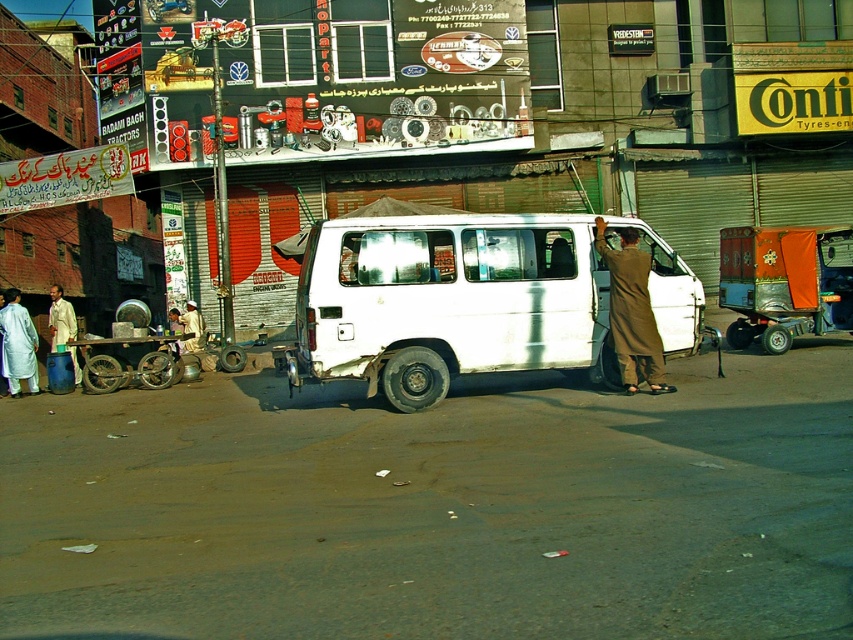
Question: Which of the following is the closest to the observer?

Choices:
 (A) (22, 349)
 (B) (387, 312)
 (C) (633, 312)

Answer: (B)

Question: From the image, what is the correct spatial relationship of metallic silver cart at lower left in relation to white cotton shirt at left?

Choices:
 (A) right
 (B) left

Answer: (A)

Question: Can you confirm if orange fabric cart at right is bigger than brown fabric at right?

Choices:
 (A) yes
 (B) no

Answer: (A)

Question: Does brown fabric at right have a larger size compared to metallic silver cart at lower left?

Choices:
 (A) yes
 (B) no

Answer: (B)

Question: Which of the following is the farthest from the observer?

Choices:
 (A) white cotton shirt at left
 (B) white matte van at center
 (C) white cotton robe at left

Answer: (A)

Question: Which object appears farthest from the camera in this image?

Choices:
 (A) white cotton robe at left
 (B) brown fabric at right
 (C) white cotton shirt at left
 (D) orange fabric cart at right

Answer: (C)